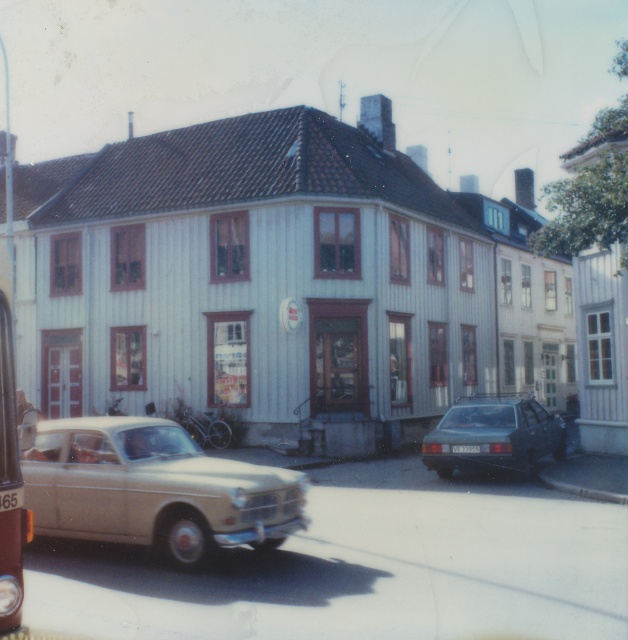
Is beige matte car at left positioned behind white plastic license plate at center?

No.

Describe the element at coordinates (154, 490) in the screenshot. The image size is (628, 640). I see `beige matte car at left` at that location.

Which is behind, point (266, 483) or point (455, 451)?

The point (455, 451) is behind.

This screenshot has width=628, height=640. In order to click on beige matte car at left in this screenshot , I will do `click(154, 490)`.

Does beige matte car at left appear on the left side of metallic silver bus at left?

In fact, beige matte car at left is to the right of metallic silver bus at left.

Between point (225, 474) and point (8, 326), which one is positioned in front?

Positioned in front is point (8, 326).

I want to click on beige matte car at left, so click(154, 490).

Does metallic silver bus at left appear on the left side of white plastic license plate at center?

Correct, you'll find metallic silver bus at left to the left of white plastic license plate at center.

Does point (11, 444) come farther from viewer compared to point (479, 448)?

No.

Where is `metallic silver bus at left`? Image resolution: width=628 pixels, height=640 pixels. metallic silver bus at left is located at coordinates (8, 465).